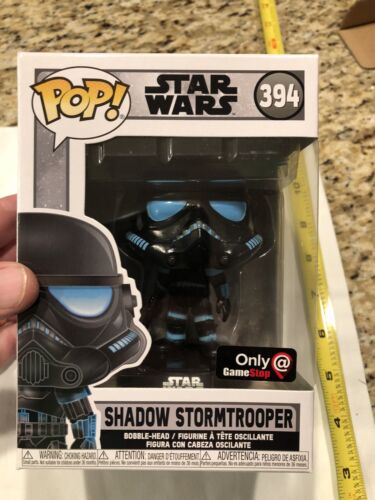
The height and width of the screenshot is (500, 375). I want to click on toy box, so click(x=78, y=307).